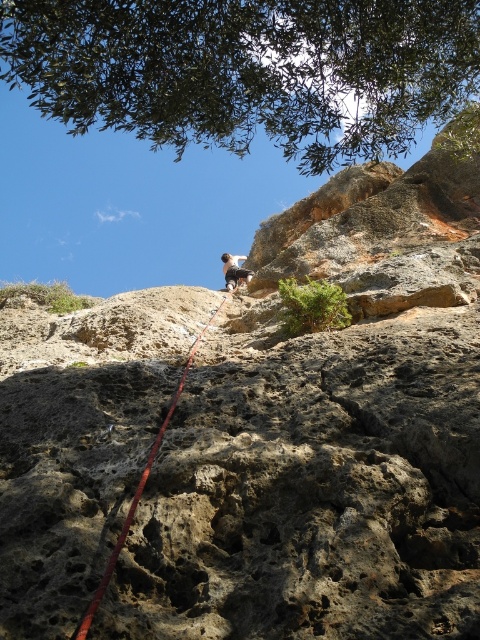
Question: Does red nylon rope at center lie behind white fabric rock climber at upper center?

Choices:
 (A) yes
 (B) no

Answer: (B)

Question: Which point appears closest to the camera in this image?

Choices:
 (A) (48, 20)
 (B) (96, 605)

Answer: (B)

Question: Among these objects, which one is nearest to the camera?

Choices:
 (A) white fabric rock climber at upper center
 (B) red nylon rope at center
 (C) green leafy tree at upper center

Answer: (B)

Question: Which point appears farthest from the camera in this image?

Choices:
 (A) (228, 260)
 (B) (372, 38)
 (C) (87, 627)

Answer: (A)

Question: Is the position of green leafy tree at upper center more distant than that of white fabric rock climber at upper center?

Choices:
 (A) yes
 (B) no

Answer: (B)

Question: Can you confirm if red nylon rope at center is bigger than white fabric rock climber at upper center?

Choices:
 (A) yes
 (B) no

Answer: (B)